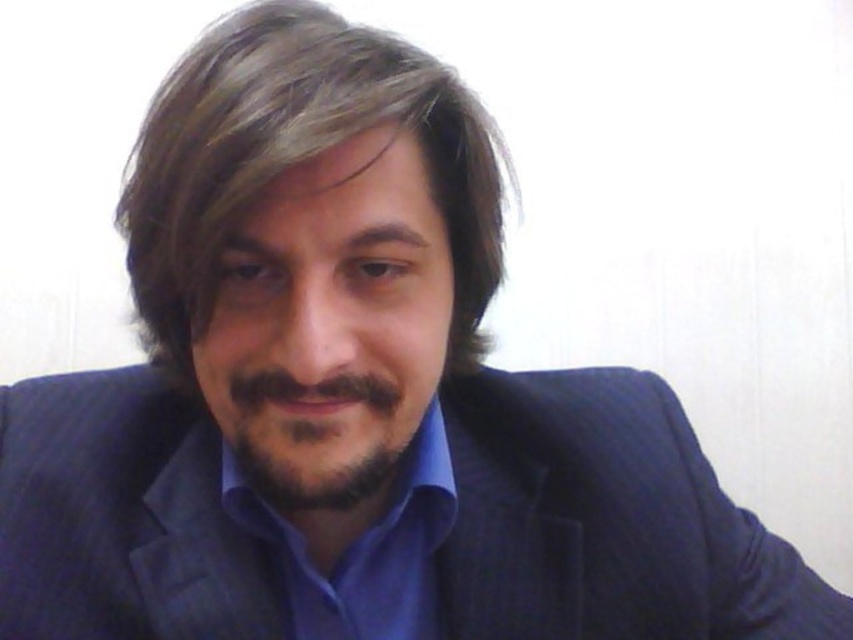
Between brownsmoothhair at center and dark brown stubble at center, which one has more height?

brownsmoothhair at center is taller.

Which is more to the right, brownsmoothhair at center or dark brown stubble at center?

dark brown stubble at center

Who is more distant from viewer, (305, 156) or (361, 376)?

The point (361, 376) is behind.

Where is `brownsmoothhair at center`? The height and width of the screenshot is (640, 853). brownsmoothhair at center is located at coordinates (294, 160).

Does blue smooth shirt at center have a larger size compared to dark brown stubble at center?

Yes.

Between point (352, 618) and point (260, 371), which one is positioned in front?

Point (260, 371)

Where is `blue smooth shirt at center`? blue smooth shirt at center is located at coordinates (363, 548).

Who is higher up, dark blue textured suit at center or blue smooth shirt at center?

dark blue textured suit at center is higher up.

Does dark blue textured suit at center have a larger size compared to blue smooth shirt at center?

Correct, dark blue textured suit at center is larger in size than blue smooth shirt at center.

Where is `dark blue textured suit at center`? Image resolution: width=853 pixels, height=640 pixels. dark blue textured suit at center is located at coordinates (606, 522).